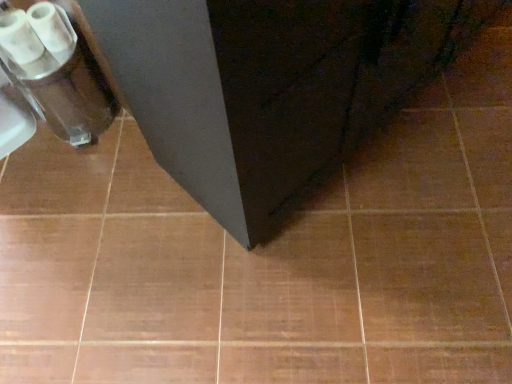
The width and height of the screenshot is (512, 384). What do you see at coordinates (272, 88) in the screenshot? I see `matte black cabinet at center` at bounding box center [272, 88].

I want to click on matte black cabinet at center, so [272, 88].

Identify the location of white glossy toilet paper at upper left. (33, 33).

What do you see at coordinates (33, 33) in the screenshot?
I see `white glossy toilet paper at upper left` at bounding box center [33, 33].

The height and width of the screenshot is (384, 512). In order to click on matte black cabinet at center in this screenshot , I will do 272,88.

Between matte black cabinet at center and white glossy toilet paper at upper left, which one appears on the right side from the viewer's perspective?

From the viewer's perspective, matte black cabinet at center appears more on the right side.

Which is in front, matte black cabinet at center or white glossy toilet paper at upper left?

matte black cabinet at center is more forward.

Which is farther from the camera, (414, 9) or (57, 27)?

The point (57, 27) is behind.

From the image's perspective, is matte black cabinet at center positioned above or below white glossy toilet paper at upper left?

From the image's perspective, matte black cabinet at center appears above white glossy toilet paper at upper left.

From a real-world perspective, which object rests below the other?

white glossy toilet paper at upper left is physically lower.

Looking at this image, considering the relative sizes of matte black cabinet at center and white glossy toilet paper at upper left in the image provided, is matte black cabinet at center wider than white glossy toilet paper at upper left?

Yes.

Is matte black cabinet at center taller than white glossy toilet paper at upper left?

Yes.

Can you confirm if matte black cabinet at center is smaller than white glossy toilet paper at upper left?

Actually, matte black cabinet at center might be larger than white glossy toilet paper at upper left.

Do you think matte black cabinet at center is within white glossy toilet paper at upper left, or outside of it?

matte black cabinet at center is outside white glossy toilet paper at upper left.

Can you see matte black cabinet at center touching white glossy toilet paper at upper left?

matte black cabinet at center and white glossy toilet paper at upper left are not in contact.

Is matte black cabinet at center aimed at white glossy toilet paper at upper left?

No, matte black cabinet at center is not aimed at white glossy toilet paper at upper left.

Looking at this image, how different are the orientations of matte black cabinet at center and white glossy toilet paper at upper left in degrees?

The angular difference between matte black cabinet at center and white glossy toilet paper at upper left is 90 degrees.

In order to click on toilet paper on the left of matte black cabinet at center in this screenshot , I will do `click(33, 33)`.

Which is more to the right, white glossy toilet paper at upper left or matte black cabinet at center?

matte black cabinet at center is more to the right.

Does white glossy toilet paper at upper left lie in front of matte black cabinet at center?

No, white glossy toilet paper at upper left is further to the viewer.

Does point (11, 32) appear closer or farther from the camera than point (128, 52)?

Point (11, 32).

From the image's perspective, is white glossy toilet paper at upper left located above or below matte black cabinet at center?

Based on their image positions, white glossy toilet paper at upper left is located beneath matte black cabinet at center.

From a real-world perspective, between white glossy toilet paper at upper left and matte black cabinet at center, who is vertically higher?

In real-world perspective, matte black cabinet at center is above.

Can you confirm if white glossy toilet paper at upper left is thinner than matte black cabinet at center?

Indeed, white glossy toilet paper at upper left has a lesser width compared to matte black cabinet at center.

Considering the relative sizes of white glossy toilet paper at upper left and matte black cabinet at center in the image provided, is white glossy toilet paper at upper left taller than matte black cabinet at center?

Incorrect, the height of white glossy toilet paper at upper left is not larger of that of matte black cabinet at center.

In the scene shown: Is white glossy toilet paper at upper left bigger than matte black cabinet at center?

No.

Would you say white glossy toilet paper at upper left is outside matte black cabinet at center?

That's correct, white glossy toilet paper at upper left is outside of matte black cabinet at center.

Is the surface of white glossy toilet paper at upper left in direct contact with matte black cabinet at center?

white glossy toilet paper at upper left is not next to matte black cabinet at center, and they're not touching.

Is white glossy toilet paper at upper left oriented towards matte black cabinet at center?

No.

Find the location of a particular element. This screenshot has height=384, width=512. toilet paper below the matte black cabinet at center (from the image's perspective) is located at coordinates (33, 33).

Where is `toilet paper on the left of matte black cabinet at center`? toilet paper on the left of matte black cabinet at center is located at coordinates (33, 33).

Where is `furniture in front of the white glossy toilet paper at upper left`? This screenshot has width=512, height=384. furniture in front of the white glossy toilet paper at upper left is located at coordinates (272, 88).